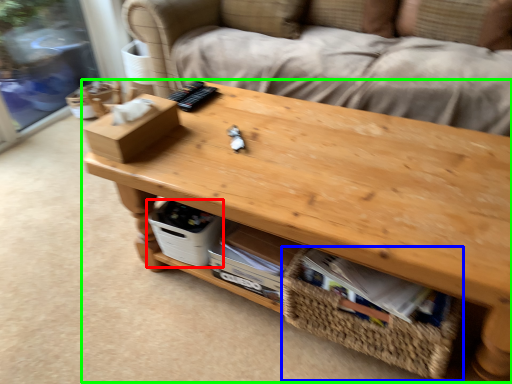
Question: Based on their relative distances, which object is farther from storage box (highlighted by a red box)? Choose from basket (highlighted by a blue box) and table (highlighted by a green box).

Choices:
 (A) basket
 (B) table

Answer: (A)